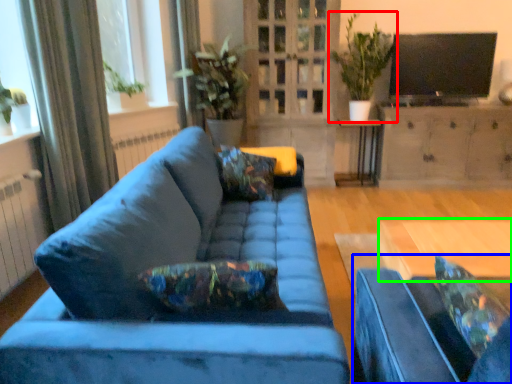
Question: Which is nearer to the houseplant (highlighted by a red box)? studio couch (highlighted by a blue box) or desk (highlighted by a green box).

Choices:
 (A) studio couch
 (B) desk

Answer: (B)